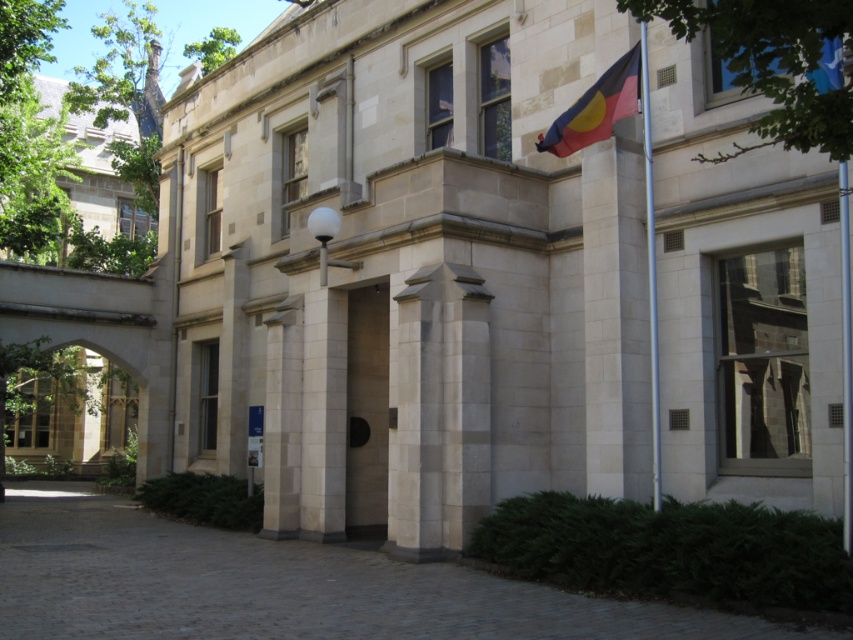
Question: Which object is closer to the camera taking this photo?

Choices:
 (A) smooth stone door at center
 (B) silver metallic flag pole at center

Answer: (B)

Question: Considering the relative positions of smooth stone door at center and silver metallic flag pole at center in the image provided, where is smooth stone door at center located with respect to silver metallic flag pole at center?

Choices:
 (A) below
 (B) above

Answer: (A)

Question: Which point is farther from the camera taking this photo?

Choices:
 (A) (625, 74)
 (B) (653, 300)

Answer: (A)

Question: Which point is closer to the camera?

Choices:
 (A) smooth stone door at center
 (B) white stone column at center

Answer: (B)

Question: Observing the image, what is the correct spatial positioning of white stone column at center in reference to silver metallic flag pole at center?

Choices:
 (A) below
 (B) above

Answer: (A)

Question: Does smooth stone door at center appear on the right side of textured fabric flag at upper right?

Choices:
 (A) yes
 (B) no

Answer: (B)